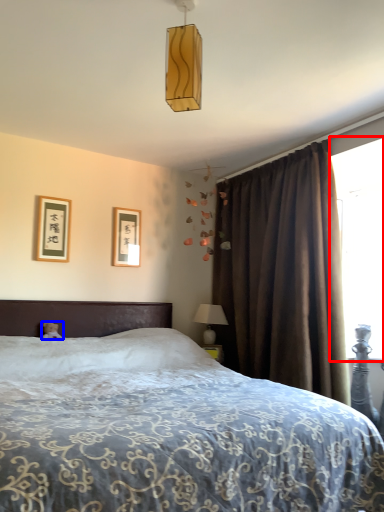
Question: Which object is closer to the camera taking this photo, window screen (highlighted by a red box) or teddy bear (highlighted by a blue box)?

Choices:
 (A) window screen
 (B) teddy bear

Answer: (B)